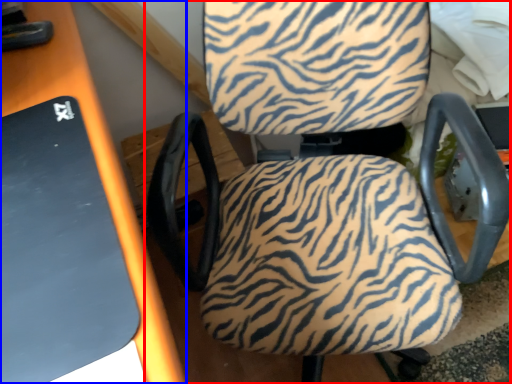
Question: Which of the following is the closest to the observer, chair (highlighted by a red box) or table (highlighted by a blue box)?

Choices:
 (A) chair
 (B) table

Answer: (A)